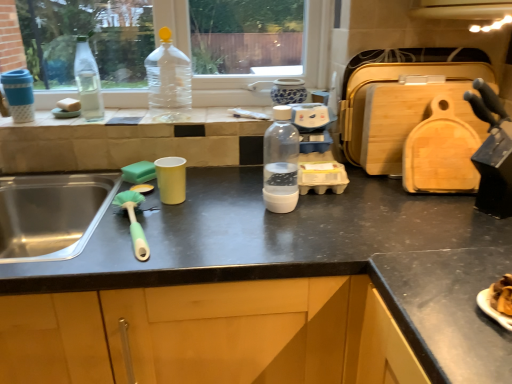
The image size is (512, 384). I want to click on vacant space that is to the left of transparent plastic bottle at center, the first bottle from the right, so click(x=217, y=212).